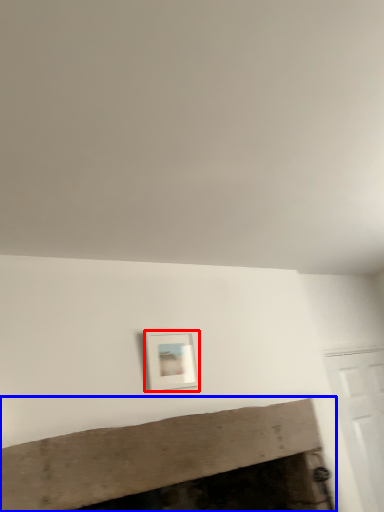
Question: Which point is closer to the camera, picture frame (highlighted by a red box) or fireplace (highlighted by a blue box)?

Choices:
 (A) picture frame
 (B) fireplace

Answer: (B)